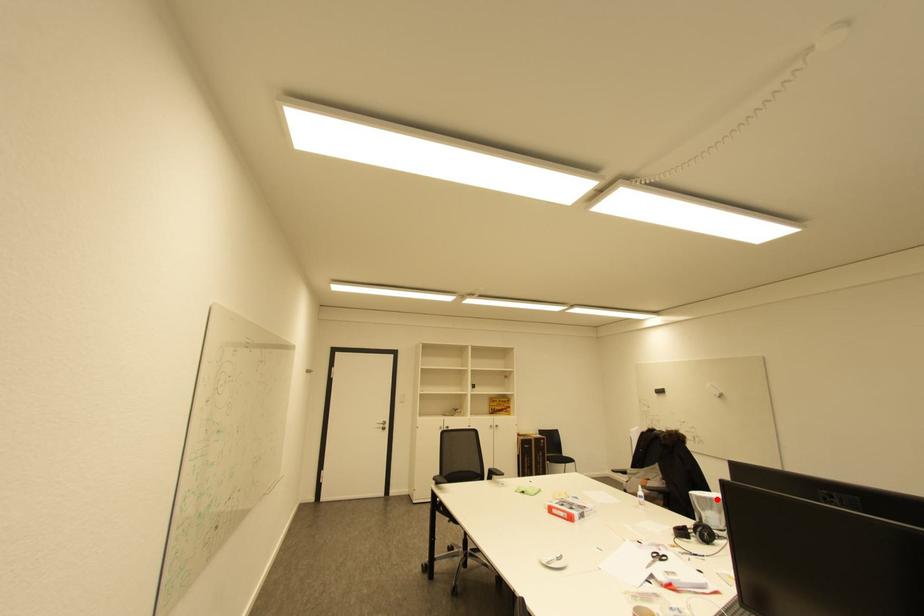
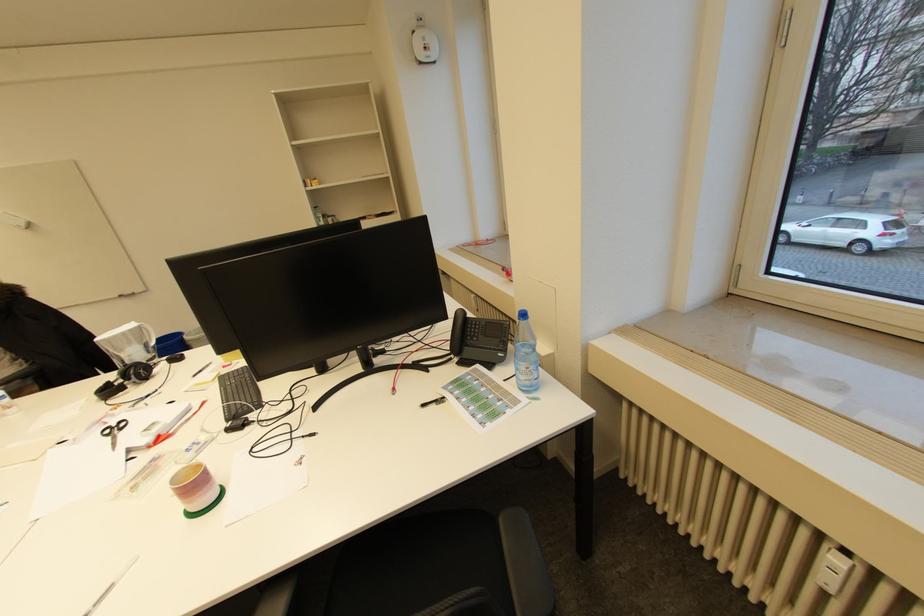
Find the pixel in the second image that matches the highlighted location in the first image.

(129, 334)